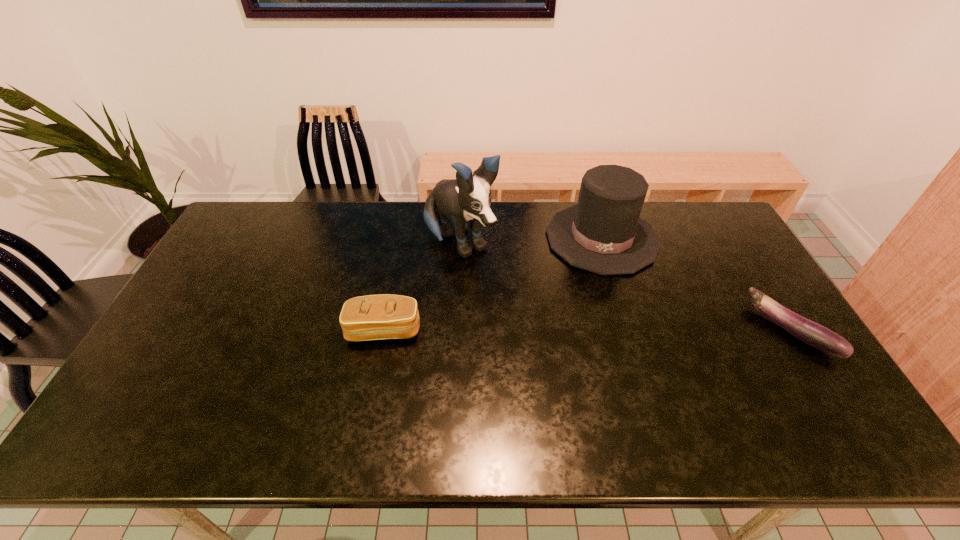
Locate an element on the screen. This screenshot has width=960, height=540. clutch bag is located at coordinates (374, 317).

Identify the location of eggplant. (810, 332).

Where is `the shortest object`? the shortest object is located at coordinates (810, 332).

This screenshot has height=540, width=960. What are the coordinates of `puppy` in the screenshot? It's located at (468, 197).

I want to click on dress hat, so click(603, 233).

You are a GUI agent. You are given a task and a screenshot of the screen. Output one action in this format:
    pyautogui.click(x=<x>, y=<y>)
    Task: Click on the second tallest object
    The image size is (960, 540).
    Given the screenshot: What is the action you would take?
    pyautogui.click(x=603, y=233)

Identify the location of vacant space located on the left of the eggplant. The image size is (960, 540). (617, 330).

Identify the location of free spot located 0.160m on the front-facing side of the tallest object. The image size is (960, 540). (508, 301).

At what (x,y) coordinates should I click in order to perform the action: click on vacant space positioned 0.380m on the front-facing side of the tallest object. Please return your answer as a coordinate pair (x, y). The height and width of the screenshot is (540, 960). Looking at the image, I should click on (555, 353).

Identify the location of vacant space located on the front-facing side of the tallest object. (526, 321).